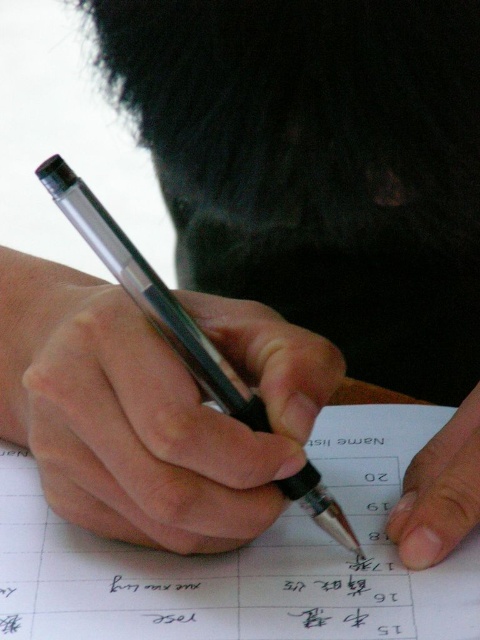
You are a photographer trying to capture a closeup of the metallic pen at center and the white paper at center. Based on their positions, which object should you focus on first to ensure both are in sharp focus?

The metallic pen at center is closer to the viewer than the white paper at center. To ensure both are in sharp focus, you should focus on the metallic pen at center first, as it is the closer object.